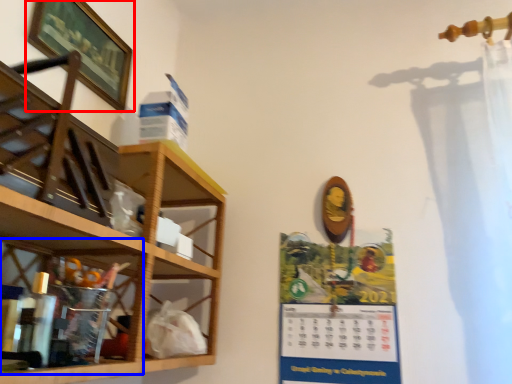
Question: Which object appears closest to the camera in this image, picture frame (highlighted by a red box) or cabinet (highlighted by a blue box)?

Choices:
 (A) picture frame
 (B) cabinet

Answer: (B)